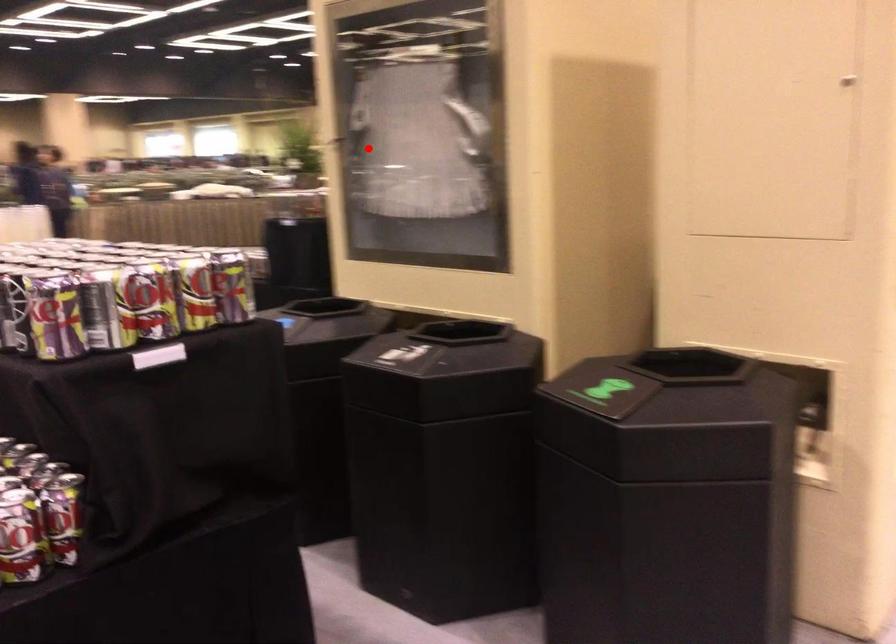
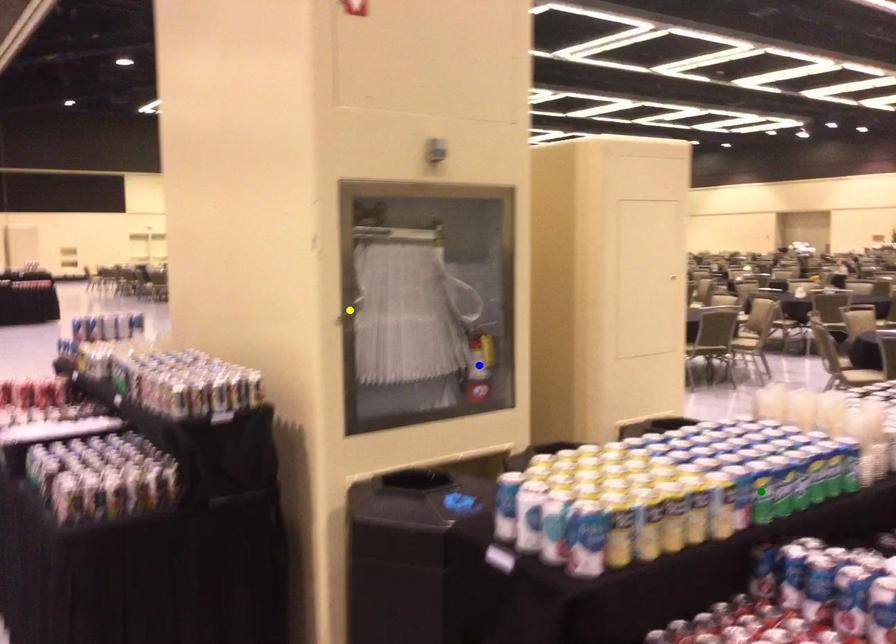
Question: I am providing you with two images of the same scene from different viewpoints. A red point is marked on the first image. You are given multiple points on the second image. In image 2, which mark is for the same physical point as the one in image 1?

Choices:
 (A) yellow point
 (B) green point
 (C) blue point

Answer: (A)